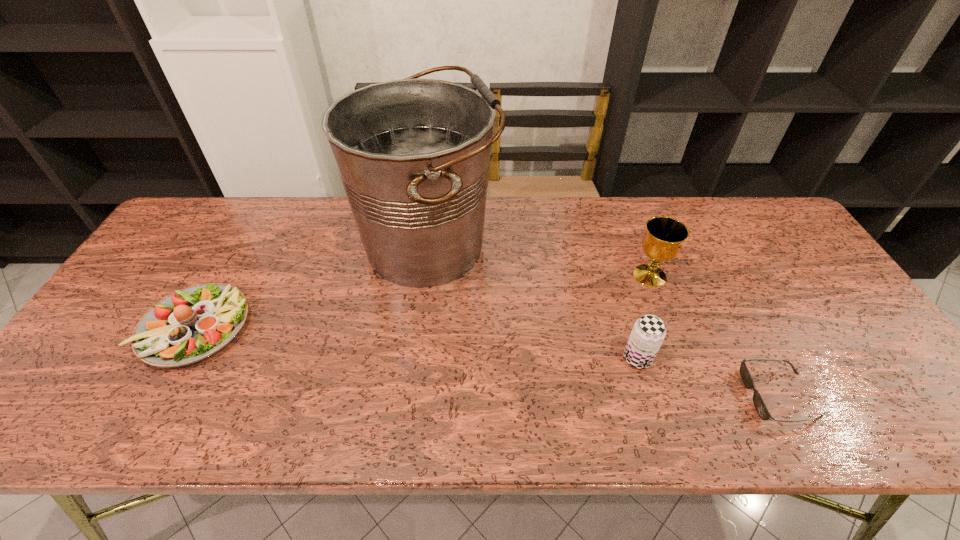
Find the location of a particular element. This screenshot has height=540, width=960. vacant region located on the right of the second object from left to right is located at coordinates (522, 245).

Identify the location of vacant space located on the right of the chalice. (729, 275).

You are a GUI agent. You are given a task and a screenshot of the screen. Output one action in this format:
    pyautogui.click(x=<x>, y=<y>)
    Task: Click on the free space located on the left of the third tallest object
    
    Given the screenshot: What is the action you would take?
    pyautogui.click(x=469, y=359)

Locate an element on the screen. The height and width of the screenshot is (540, 960). free space located 0.150m on the front of the second shortest object is located at coordinates (135, 434).

At what (x,y) coordinates should I click in order to perform the action: click on vacant region located 0.250m on the front-facing side of the shortest object. Please return your answer as a coordinate pair (x, y). Looking at the image, I should click on (636, 396).

Find the location of a particular element. This screenshot has width=960, height=540. vacant space located 0.100m on the front-facing side of the shortest object is located at coordinates (703, 396).

This screenshot has height=540, width=960. Find the location of `free space located on the front-facing side of the shortest object`. free space located on the front-facing side of the shortest object is located at coordinates (716, 396).

This screenshot has width=960, height=540. I want to click on object that is at the far edge, so click(x=413, y=155).

The height and width of the screenshot is (540, 960). Find the location of `object situated at the near edge`. object situated at the near edge is located at coordinates (759, 404).

Where is `object positioned at the left edge`? object positioned at the left edge is located at coordinates (191, 324).